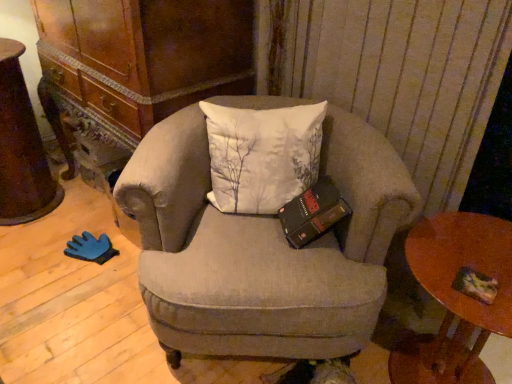
Question: Visually, is textured beige armchair at center positioned to the left or to the right of multicolored paper at lower right?

Choices:
 (A) left
 (B) right

Answer: (A)

Question: Considering the positions of textured beige armchair at center and multicolored paper at lower right in the image, is textured beige armchair at center bigger or smaller than multicolored paper at lower right?

Choices:
 (A) big
 (B) small

Answer: (A)

Question: Which is farther from the textured beige armchair at center?

Choices:
 (A) rustic wood desk at left
 (B) wooden round table at lower right
 (C) multicolored paper at lower right

Answer: (A)

Question: Which is nearer to the textured beige armchair at center?

Choices:
 (A) wooden round table at lower right
 (B) multicolored paper at lower right
 (C) rustic wood desk at left

Answer: (A)